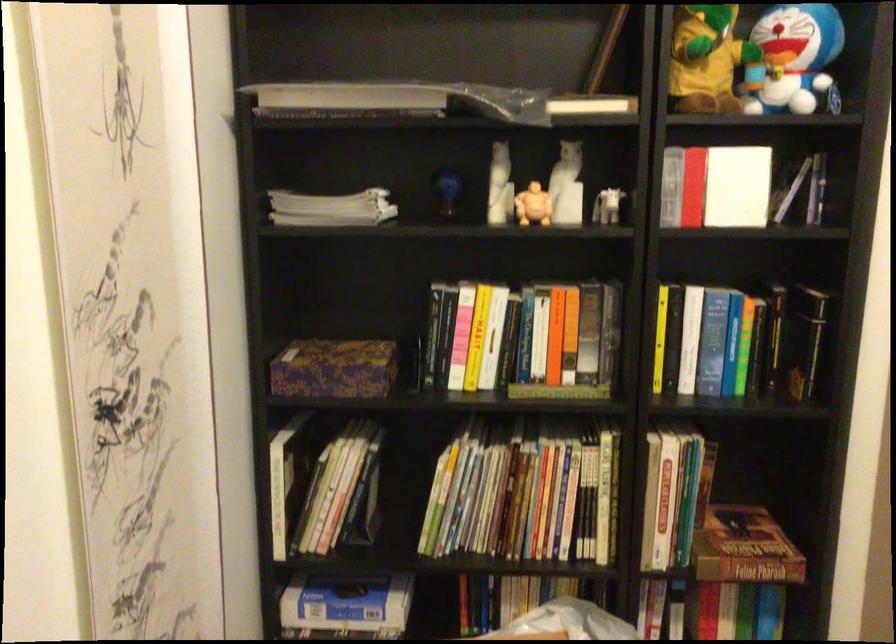
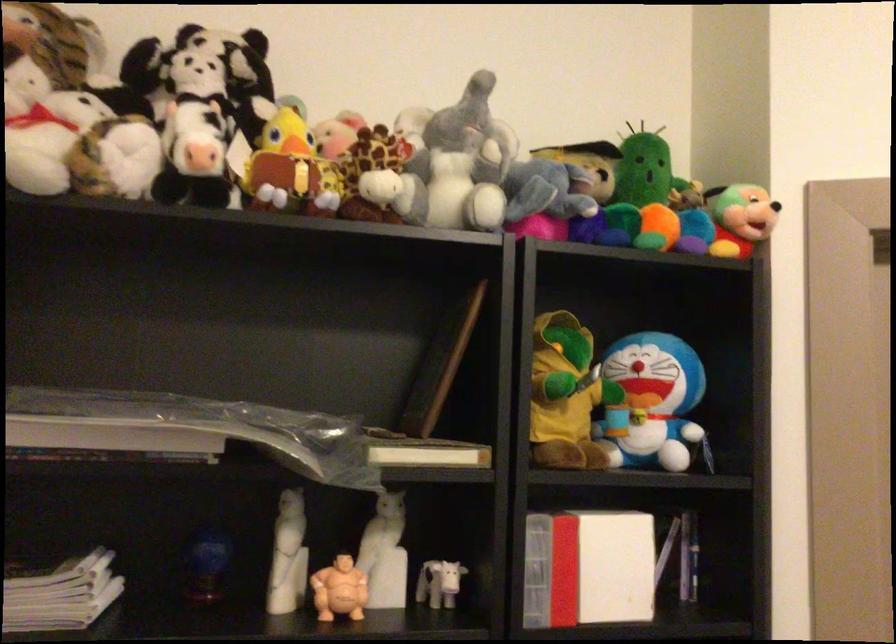
Where in the second image is the point corresponding to point 734,183 from the first image?

(609, 565)